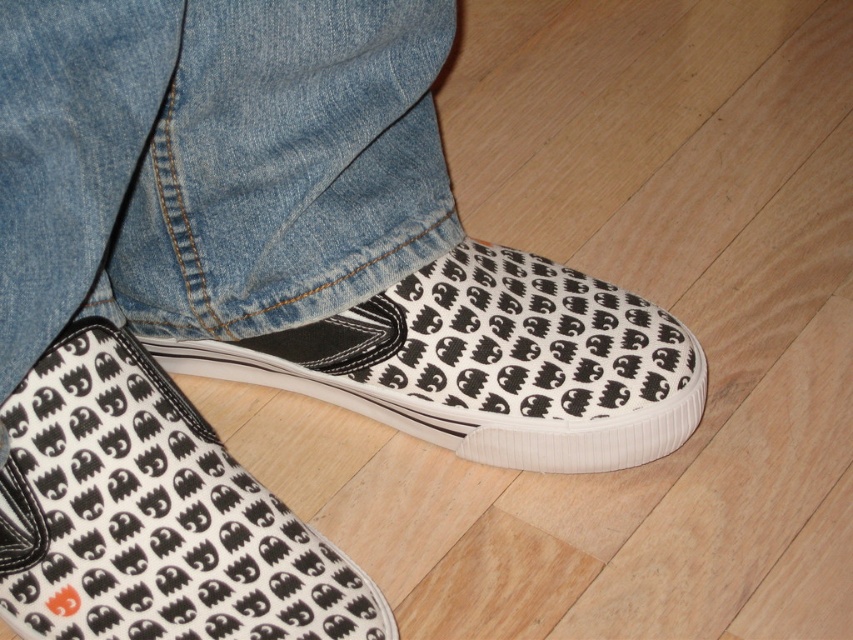
Is point (90, 486) farther from viewer compared to point (593, 314)?

No, (90, 486) is in front of (593, 314).

Does white canvas shoe at lower center come in front of white canvas shoe at center?

Yes.

Does point (299, 611) lie in front of point (425, 275)?

Yes, it is.

Where is `white canvas shoe at lower center`? The width and height of the screenshot is (853, 640). white canvas shoe at lower center is located at coordinates (151, 515).